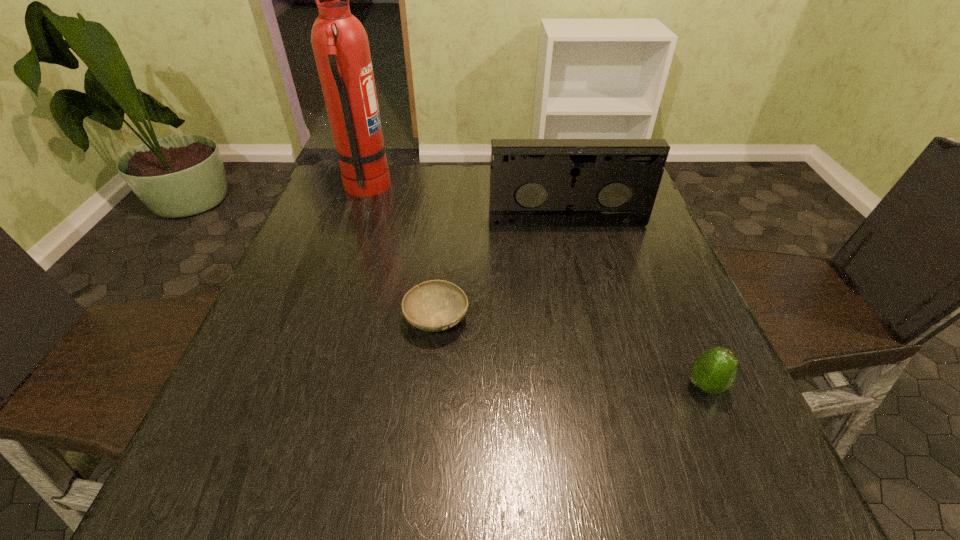
What are the coordinates of `vacant region at the right edge of the desktop` in the screenshot? It's located at (690, 370).

Locate an element on the screen. The height and width of the screenshot is (540, 960). vacant space in between the shortest object and the tallest object is located at coordinates (401, 253).

Locate an element on the screen. The width and height of the screenshot is (960, 540). free spot between the avocado and the third farthest object is located at coordinates (570, 352).

Where is `vacant space in between the tallest object and the avocado`? This screenshot has height=540, width=960. vacant space in between the tallest object and the avocado is located at coordinates (536, 287).

Image resolution: width=960 pixels, height=540 pixels. I want to click on vacant space that's between the avocado and the third shortest object, so click(636, 304).

Find the location of a particular element. The height and width of the screenshot is (540, 960). free space between the avocado and the leftmost object is located at coordinates (536, 287).

Find the location of `vacant area that lies between the second tallest object and the third farthest object`. vacant area that lies between the second tallest object and the third farthest object is located at coordinates (502, 271).

At what (x,y) coordinates should I click in order to perform the action: click on vacant space that is in between the third tallest object and the fire extinguisher. Please return your answer as a coordinate pair (x, y). This screenshot has width=960, height=540. Looking at the image, I should click on (536, 287).

The width and height of the screenshot is (960, 540). I want to click on free point between the bowl and the fire extinguisher, so click(401, 253).

At what (x,y) coordinates should I click in order to perform the action: click on unoccupied position between the fire extinguisher and the third tallest object. Please return your answer as a coordinate pair (x, y). The image size is (960, 540). Looking at the image, I should click on coord(536,287).